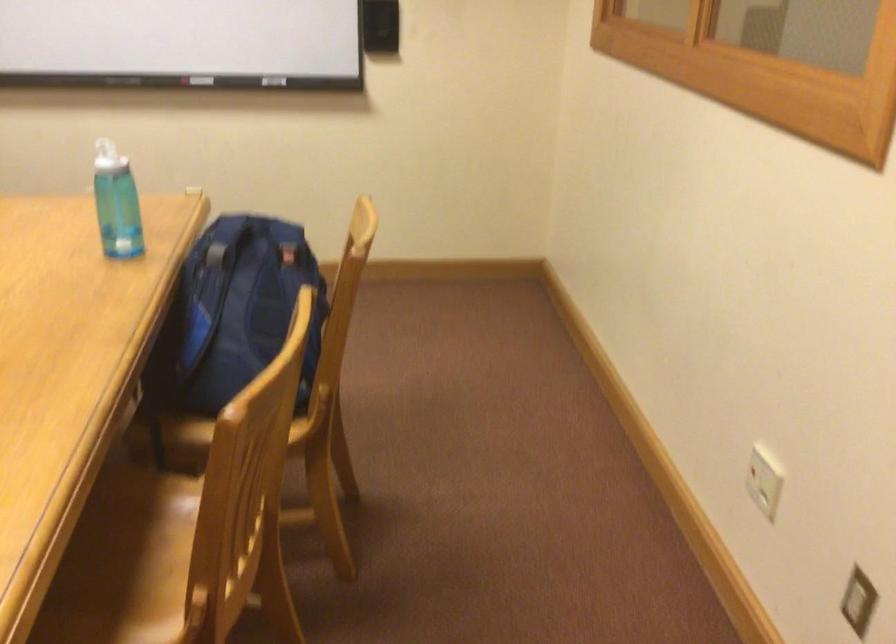
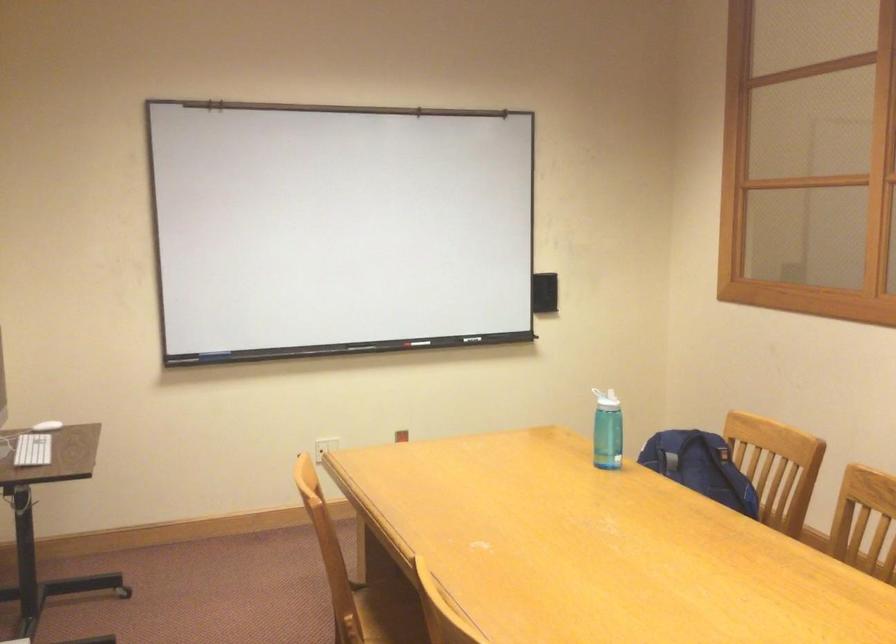
Question: What movement of the cameraman would produce the second image?

Choices:
 (A) Left
 (B) Right
 (C) Forward
 (D) Backward

Answer: (A)